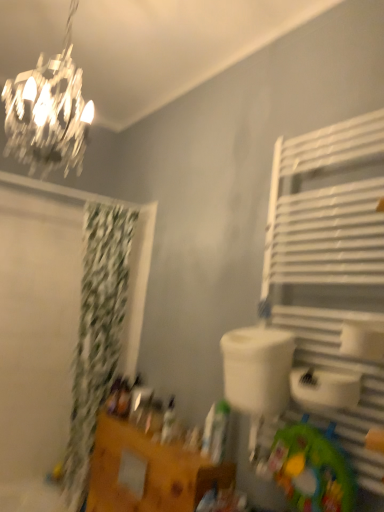
Question: Should I look upward or downward to see white plastic sink at center?

Choices:
 (A) up
 (B) down

Answer: (B)

Question: Does white metal towel rack at right lie in front of green fabric shower curtain at left?

Choices:
 (A) no
 (B) yes

Answer: (B)

Question: From a real-world perspective, is white metal towel rack at right positioned under green fabric shower curtain at left based on gravity?

Choices:
 (A) yes
 (B) no

Answer: (B)

Question: From the image's perspective, does white metal towel rack at right appear lower than green fabric shower curtain at left?

Choices:
 (A) no
 (B) yes

Answer: (A)

Question: Considering the relative sizes of white metal towel rack at right and green fabric shower curtain at left in the image provided, is white metal towel rack at right taller than green fabric shower curtain at left?

Choices:
 (A) no
 (B) yes

Answer: (A)

Question: Considering the relative positions of white metal towel rack at right and green fabric shower curtain at left in the image provided, is white metal towel rack at right behind green fabric shower curtain at left?

Choices:
 (A) yes
 (B) no

Answer: (B)

Question: Can you confirm if white metal towel rack at right is shorter than green fabric shower curtain at left?

Choices:
 (A) yes
 (B) no

Answer: (A)

Question: Is white metal towel rack at right outside white plastic sink at center?

Choices:
 (A) yes
 (B) no

Answer: (A)

Question: Is white metal towel rack at right positioned with its back to white plastic sink at center?

Choices:
 (A) yes
 (B) no

Answer: (A)

Question: Is white plastic sink at center a part of white metal towel rack at right?

Choices:
 (A) no
 (B) yes

Answer: (A)

Question: Can you confirm if white metal towel rack at right is taller than white plastic sink at center?

Choices:
 (A) no
 (B) yes

Answer: (B)

Question: Is white metal towel rack at right not close to white plastic sink at center?

Choices:
 (A) no
 (B) yes

Answer: (A)

Question: Is white metal towel rack at right shorter than white plastic sink at center?

Choices:
 (A) yes
 (B) no

Answer: (B)

Question: Does green fabric mat at lower right have a lesser width compared to white plastic sink at center?

Choices:
 (A) no
 (B) yes

Answer: (B)